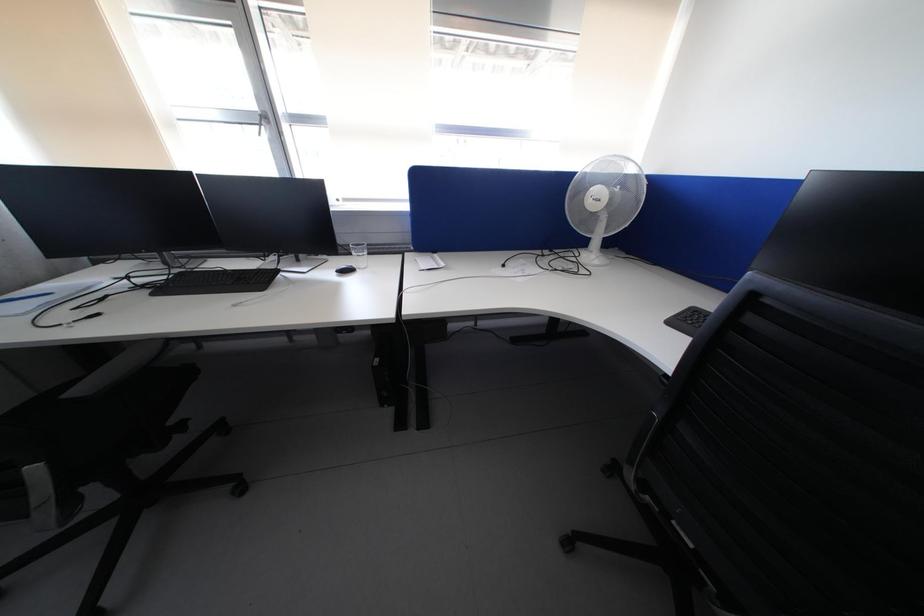
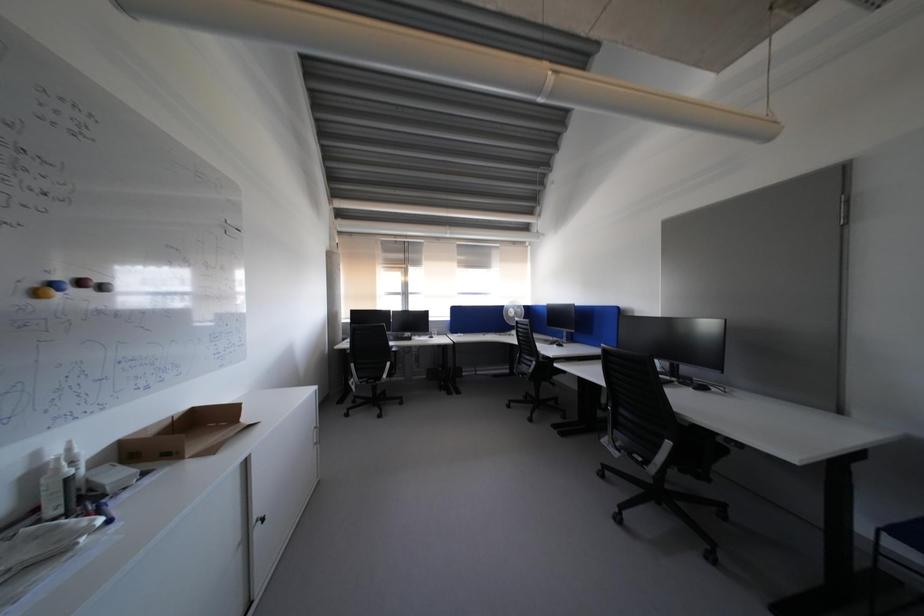
Question: In a continuous first-person perspective shot, in which direction is the camera moving?

Choices:
 (A) Left
 (B) Right
 (C) Forward
 (D) Backward

Answer: (D)